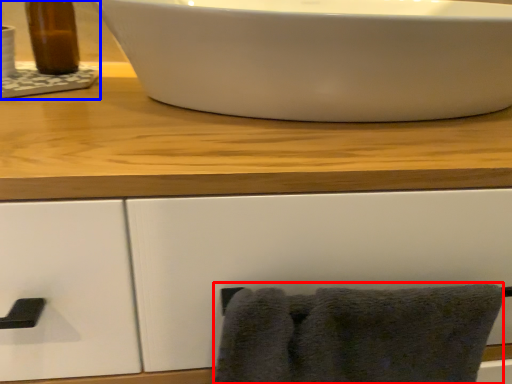
Question: Which point is closer to the camera, bath towel (highlighted by a red box) or sink (highlighted by a blue box)?

Choices:
 (A) bath towel
 (B) sink

Answer: (A)